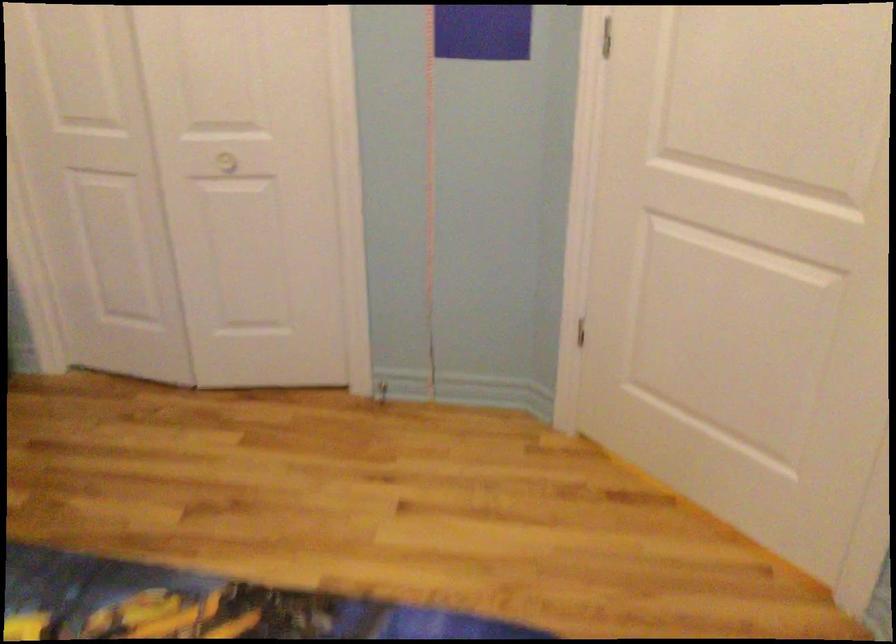
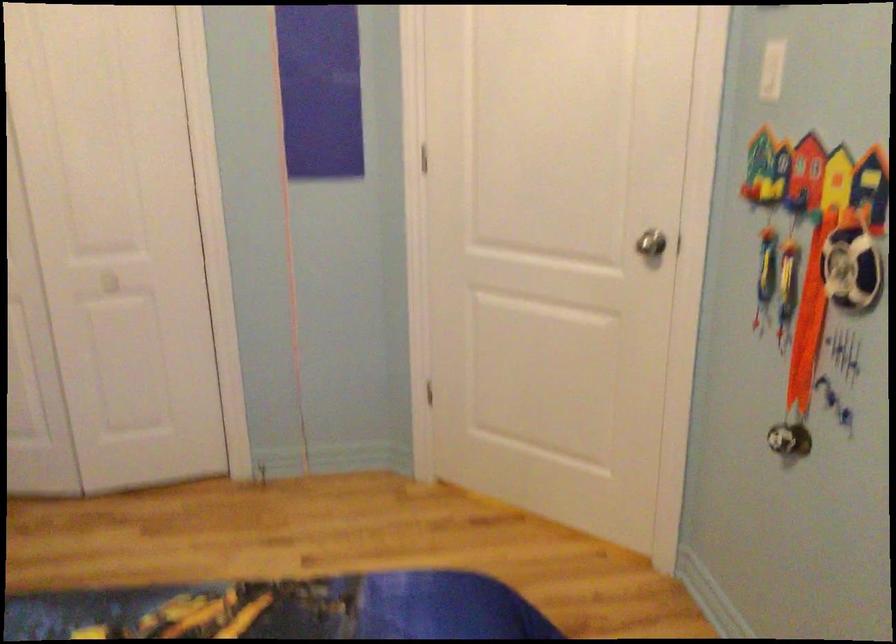
Question: The camera is either moving clockwise (left) or counter-clockwise (right) around the object. The first image is from the beginning of the video and the second image is from the end. Is the camera moving left or right when shooting the video?

Choices:
 (A) Left
 (B) Right

Answer: (A)